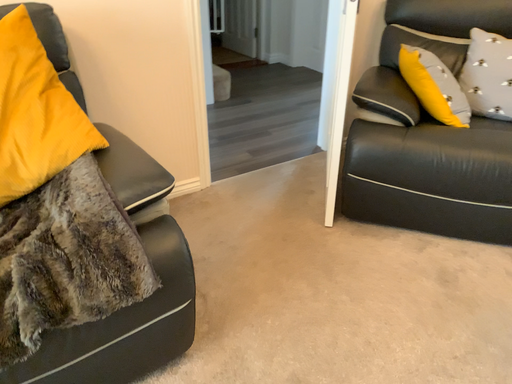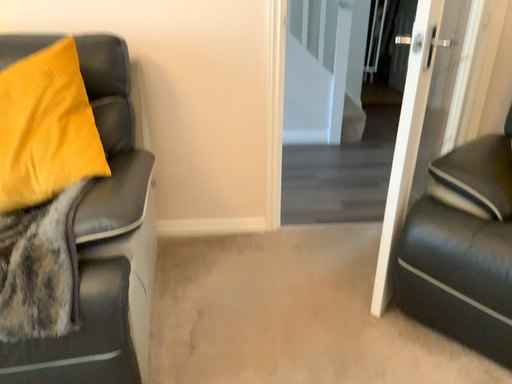
Question: How did the camera likely rotate when shooting the video?

Choices:
 (A) rotated left
 (B) rotated right

Answer: (A)